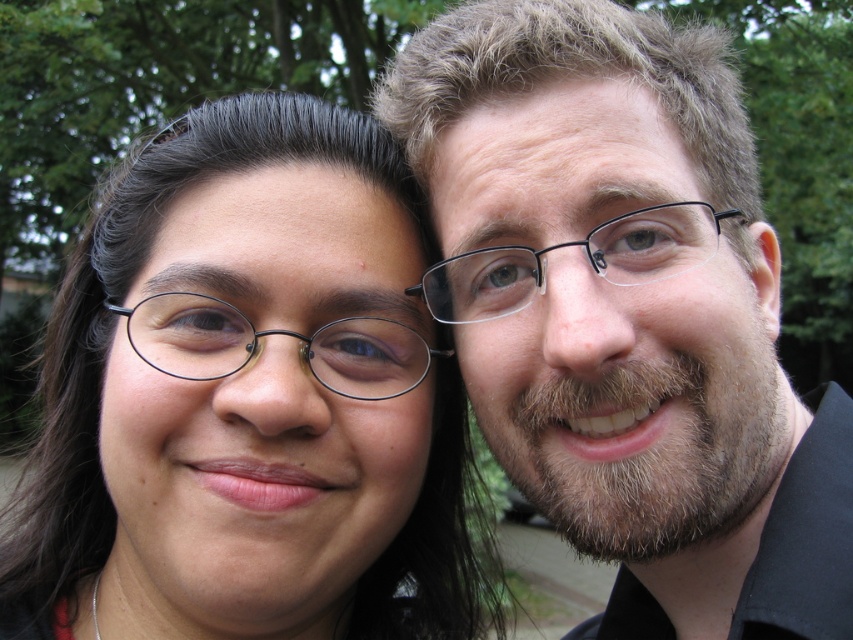
Question: Does smooth black shirt at center have a larger size compared to black plastic glasses at center?

Choices:
 (A) yes
 (B) no

Answer: (A)

Question: Among these points, which one is farthest from the camera?

Choices:
 (A) (535, 291)
 (B) (779, 280)
 (C) (370, 348)

Answer: (B)

Question: Among these objects, which one is farthest from the camera?

Choices:
 (A) matte black glasses at center
 (B) smooth black shirt at center

Answer: (A)

Question: Which is farther from the black plastic glasses at center?

Choices:
 (A) black plastic glasses at left
 (B) matte black glasses at center
 (C) smooth black shirt at center

Answer: (B)

Question: Can you confirm if matte black glasses at center is smaller than black plastic glasses at center?

Choices:
 (A) no
 (B) yes

Answer: (A)

Question: Can you confirm if black plastic glasses at left is positioned to the right of black plastic glasses at center?

Choices:
 (A) yes
 (B) no

Answer: (B)